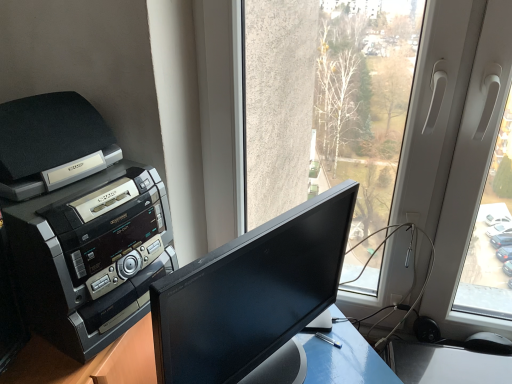
Question: In the image, is black plastic printer at left on the left side or the right side of black plastic mouse at lower right?

Choices:
 (A) right
 (B) left

Answer: (B)

Question: Is black plastic printer at left bigger or smaller than black plastic mouse at lower right?

Choices:
 (A) small
 (B) big

Answer: (B)

Question: Which object is positioned closest to the black glossy monitor at center?

Choices:
 (A) black plastic printer at left
 (B) black plastic mouse at lower right

Answer: (A)

Question: Based on their relative distances, which object is farther from the black plastic printer at left?

Choices:
 (A) black glossy monitor at center
 (B) black plastic mouse at lower right

Answer: (B)